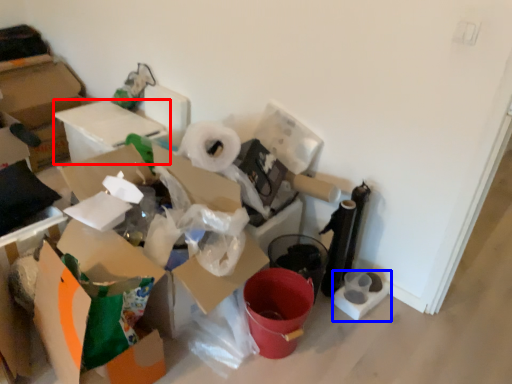
Question: Which object appears farthest to the camera in this image, cardboard box (highlighted by a red box) or toilet paper (highlighted by a blue box)?

Choices:
 (A) cardboard box
 (B) toilet paper

Answer: (A)